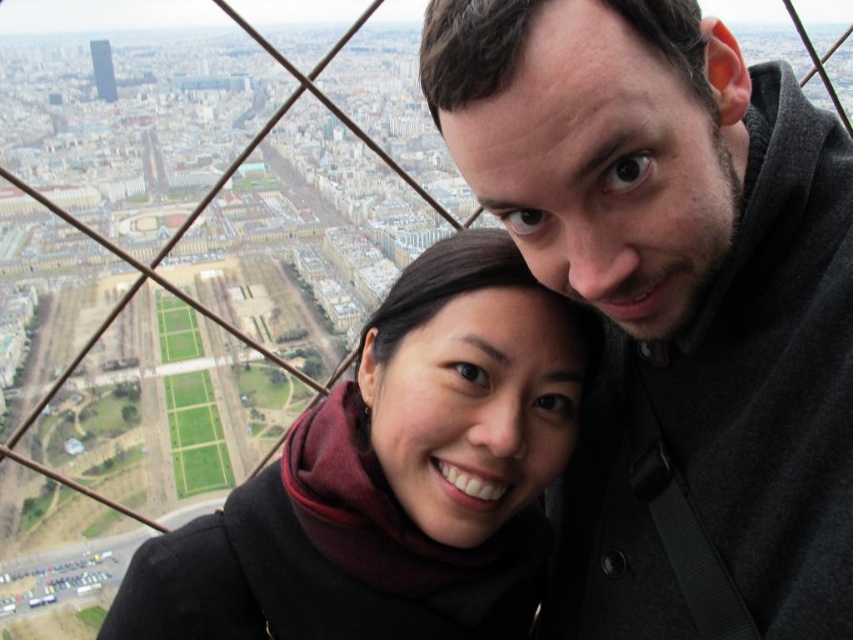
You are a photographer trying to capture a photo of both the point at (839, 547) and the point at (436, 499) in the scene. Which point should you focus on first to ensure both are in sharp focus?

You should focus on point (839, 547) first because it is closer to the camera than point (436, 499), ensuring both points will be in focus when using a proper depth of field.

You are a photographer trying to capture the scene from the top of the Eiffel Tower. You notice the dark gray sweater at upper right. Can you estimate its position relative to the center of the image using the coordinate system provided?

The dark gray sweater at upper right is located at point 0.475 on the x axis and 0.790 on the y axis, so it is positioned to the right and above the center of the image.